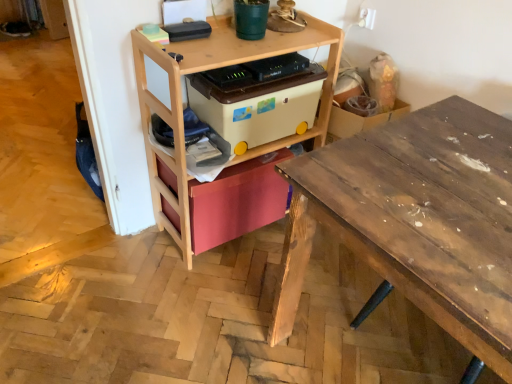
Question: Considering the relative positions of beige plastic storage box at center, which is the 1th storage box from top to bottom, and wooden desk at right in the image provided, is beige plastic storage box at center, which is the 1th storage box from top to bottom, to the right of wooden desk at right from the viewer's perspective?

Choices:
 (A) yes
 (B) no

Answer: (B)

Question: Considering the relative sizes of beige plastic storage box at center, acting as the second storage box starting from the bottom, and wooden desk at right in the image provided, is beige plastic storage box at center, acting as the second storage box starting from the bottom, wider than wooden desk at right?

Choices:
 (A) no
 (B) yes

Answer: (A)

Question: Would you consider beige plastic storage box at center, acting as the second storage box starting from the bottom, to be distant from wooden desk at right?

Choices:
 (A) no
 (B) yes

Answer: (A)

Question: Considering the relative sizes of beige plastic storage box at center, which is the 1th storage box from top to bottom, and wooden desk at right in the image provided, is beige plastic storage box at center, which is the 1th storage box from top to bottom, shorter than wooden desk at right?

Choices:
 (A) no
 (B) yes

Answer: (B)

Question: Can you confirm if beige plastic storage box at center, acting as the second storage box starting from the bottom, is positioned to the left of wooden desk at right?

Choices:
 (A) yes
 (B) no

Answer: (A)

Question: Based on their sizes in the image, would you say matte pink drawer at center, the first storage box positioned from the bottom, is bigger or smaller than wooden desk at right?

Choices:
 (A) big
 (B) small

Answer: (B)

Question: Would you say matte pink drawer at center, the first storage box positioned from the bottom, is to the left or to the right of wooden desk at right in the picture?

Choices:
 (A) left
 (B) right

Answer: (A)

Question: In terms of height, does matte pink drawer at center, the first storage box positioned from the bottom, look taller or shorter compared to wooden desk at right?

Choices:
 (A) tall
 (B) short

Answer: (B)

Question: Is matte pink drawer at center, the first storage box positioned from the bottom, in front of or behind wooden desk at right in the image?

Choices:
 (A) front
 (B) behind

Answer: (B)

Question: From a real-world perspective, is wooden shelf at center positioned above or below wooden desk at right?

Choices:
 (A) below
 (B) above

Answer: (B)

Question: From the image's perspective, is wooden shelf at center positioned above or below wooden desk at right?

Choices:
 (A) below
 (B) above

Answer: (B)

Question: In terms of width, does wooden shelf at center look wider or thinner when compared to wooden desk at right?

Choices:
 (A) thin
 (B) wide

Answer: (A)

Question: Does point (281, 49) appear closer or farther from the camera than point (316, 183)?

Choices:
 (A) farther
 (B) closer

Answer: (A)

Question: Would you say beige plastic storage box at center, acting as the second storage box starting from the bottom, is to the left or to the right of wooden desk at right in the picture?

Choices:
 (A) right
 (B) left

Answer: (B)

Question: From a real-world perspective, relative to wooden desk at right, is beige plastic storage box at center, which is the 1th storage box from top to bottom, vertically above or below?

Choices:
 (A) below
 (B) above

Answer: (B)